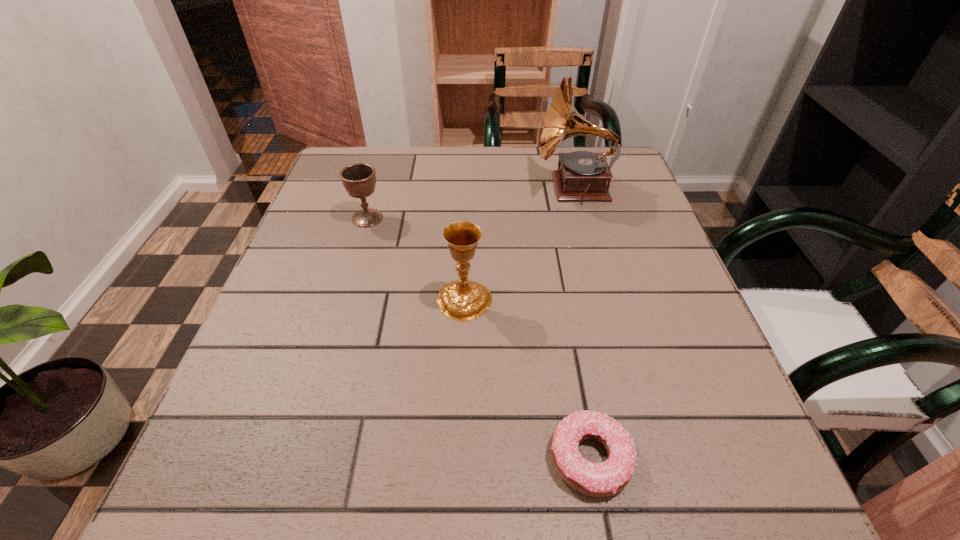
This screenshot has height=540, width=960. Identify the location of free space between the tallest object and the leftmost object. (471, 202).

Where is `blank region between the left chalice and the nearer chalice`? The width and height of the screenshot is (960, 540). blank region between the left chalice and the nearer chalice is located at coordinates (416, 259).

This screenshot has height=540, width=960. I want to click on free space between the shortest object and the right chalice, so click(527, 379).

I want to click on blank region between the second shortest object and the third farthest object, so click(x=416, y=259).

Image resolution: width=960 pixels, height=540 pixels. I want to click on the third closest object to the second shortest object, so click(608, 478).

What are the coordinates of `the closest object to the doughnut` in the screenshot? It's located at (463, 300).

This screenshot has height=540, width=960. Find the location of `vacant area in the image that satisfies the following two spatial constraints: 1. on the horn of the tallest object; 2. on the front side of the left chalice`. vacant area in the image that satisfies the following two spatial constraints: 1. on the horn of the tallest object; 2. on the front side of the left chalice is located at coordinates (583, 218).

At what (x,y) coordinates should I click in order to perform the action: click on free space that satisfies the following two spatial constraints: 1. on the horn of the tallest object; 2. on the front side of the shortest object. Please return your answer as a coordinate pair (x, y). Looking at the image, I should click on (647, 457).